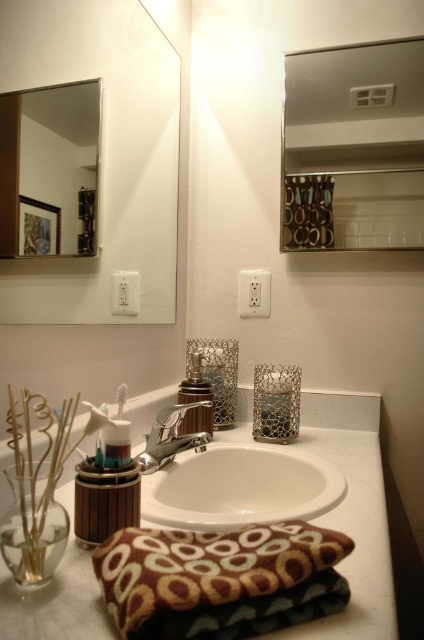
Does white matte counter top at center come behind wooden toothbrush holder at lower left?

No, white matte counter top at center is closer to the viewer.

Can you confirm if white matte counter top at center is bigger than wooden toothbrush holder at lower left?

Yes, white matte counter top at center is bigger than wooden toothbrush holder at lower left.

Locate an element on the screen. This screenshot has width=424, height=640. white matte counter top at center is located at coordinates (345, 516).

Who is positioned more to the right, clear glass mirror at upper left or white ceramic sink at center?

white ceramic sink at center is more to the right.

How far apart are clear glass mirror at upper left and white ceramic sink at center?

21.36 inches

The height and width of the screenshot is (640, 424). Describe the element at coordinates (50, 170) in the screenshot. I see `clear glass mirror at upper left` at that location.

This screenshot has width=424, height=640. Find the location of `clear glass mirror at upper left`. clear glass mirror at upper left is located at coordinates (50, 170).

Does clear glass mirror at upper left appear on the right side of polished chrome faucet at center?

In fact, clear glass mirror at upper left is to the left of polished chrome faucet at center.

Is point (75, 180) positioned before point (155, 424)?

Yes, it is.

The image size is (424, 640). What are the coordinates of `clear glass mirror at upper left` in the screenshot? It's located at (50, 170).